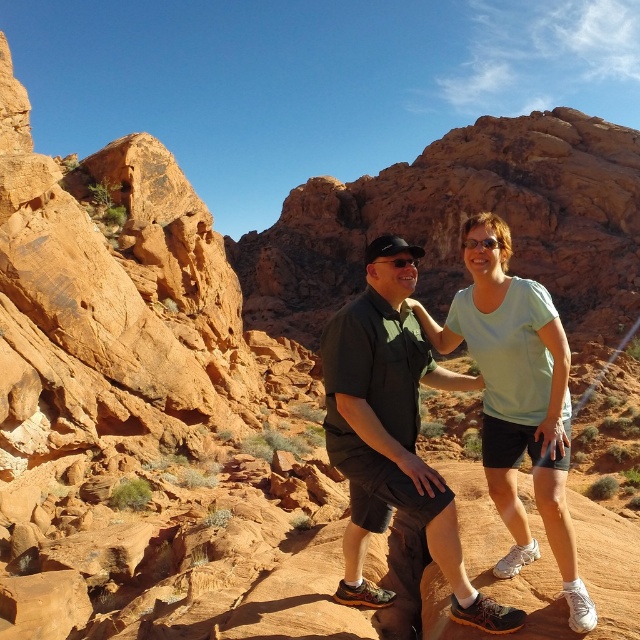
Is matte green shirt at center thinner than black matte sunglasses at center?

In fact, matte green shirt at center might be wider than black matte sunglasses at center.

Can you confirm if matte green shirt at center is bigger than black matte sunglasses at center?

Yes, matte green shirt at center is bigger than black matte sunglasses at center.

Between point (412, 490) and point (394, 266), which one is positioned behind?

The point (394, 266) is behind.

I want to click on matte green shirt at center, so coord(392,435).

Is matte green shirt at center closer to the viewer compared to light blue t-shirt at center?

No, it is behind light blue t-shirt at center.

This screenshot has width=640, height=640. I want to click on matte green shirt at center, so click(392, 435).

Is light blue t-shirt at center to the right of black matte sunglasses at center from the viewer's perspective?

Yes, light blue t-shirt at center is to the right of black matte sunglasses at center.

Does light blue t-shirt at center lie behind black matte sunglasses at center?

That is False.

This screenshot has width=640, height=640. What do you see at coordinates (516, 397) in the screenshot?
I see `light blue t-shirt at center` at bounding box center [516, 397].

Find the location of a particular element. The width and height of the screenshot is (640, 640). light blue t-shirt at center is located at coordinates (516, 397).